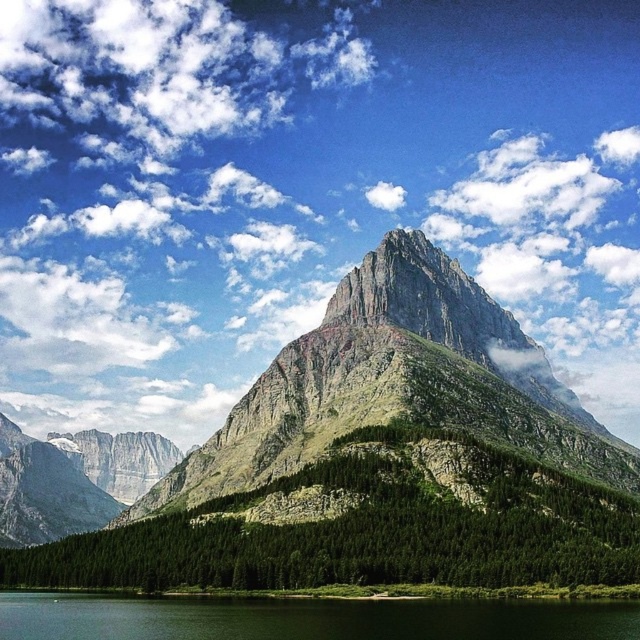
Can you confirm if green grassy mountain at center is positioned above green grassy shore at lower center?

Yes, green grassy mountain at center is above green grassy shore at lower center.

Looking at this image, is green grassy mountain at center shorter than green grassy shore at lower center?

Incorrect, green grassy mountain at center's height does not fall short of green grassy shore at lower center's.

The height and width of the screenshot is (640, 640). In order to click on green grassy mountain at center in this screenshot , I will do `click(380, 461)`.

At what (x,y) coordinates should I click in order to perform the action: click on green grassy mountain at center. Please return your answer as a coordinate pair (x, y). The image size is (640, 640). Looking at the image, I should click on point(380,461).